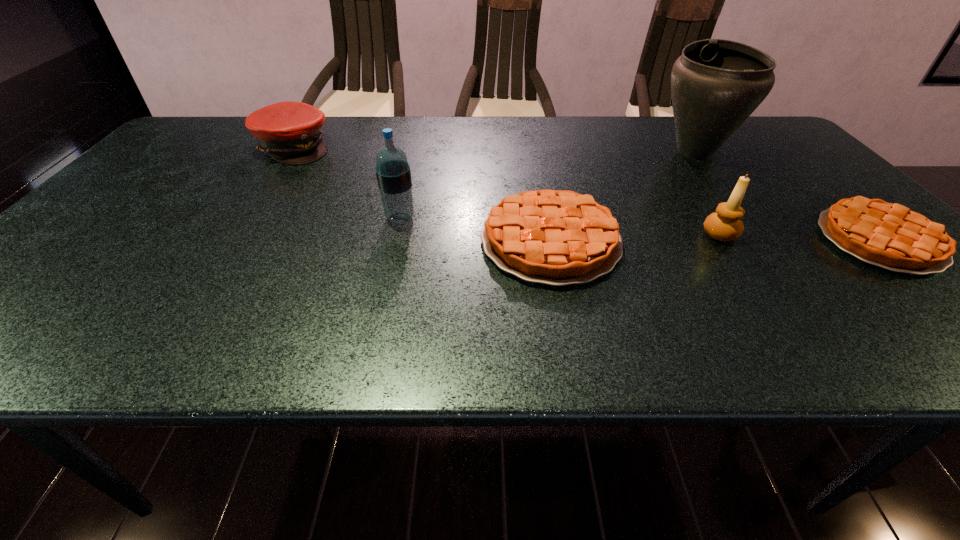
Where is `vacant space at the far left corner of the desktop`? The width and height of the screenshot is (960, 540). vacant space at the far left corner of the desktop is located at coordinates (225, 123).

The height and width of the screenshot is (540, 960). Identify the location of vacant region between the tallest object and the fifth tallest object. (623, 197).

This screenshot has width=960, height=540. I want to click on free point between the taller pie and the fifth object from right to left, so click(x=475, y=230).

At what (x,y) coordinates should I click in order to perform the action: click on empty location between the second object from left to right and the cap. Please return your answer as a coordinate pair (x, y). The image size is (960, 540). Looking at the image, I should click on (347, 183).

Where is `vacant space that's between the left pie and the fourth tallest object`? The image size is (960, 540). vacant space that's between the left pie and the fourth tallest object is located at coordinates coord(422,194).

You are a GUI agent. You are given a task and a screenshot of the screen. Output one action in this format:
    pyautogui.click(x=<x>, y=<y>)
    Task: Click on the unoccupied area between the taller pie and the urn
    The height and width of the screenshot is (540, 960).
    Given the screenshot: What is the action you would take?
    pyautogui.click(x=623, y=197)

Where is `vacant point located between the taller pie and the urn`? vacant point located between the taller pie and the urn is located at coordinates (623, 197).

Where is `free space between the tallest object and the water bottle`? The image size is (960, 540). free space between the tallest object and the water bottle is located at coordinates (547, 185).

Image resolution: width=960 pixels, height=540 pixels. Identify the location of empty location between the tallest object and the cap. (494, 150).

Where is `the closest object to the fourth tallest object`? the closest object to the fourth tallest object is located at coordinates (393, 173).